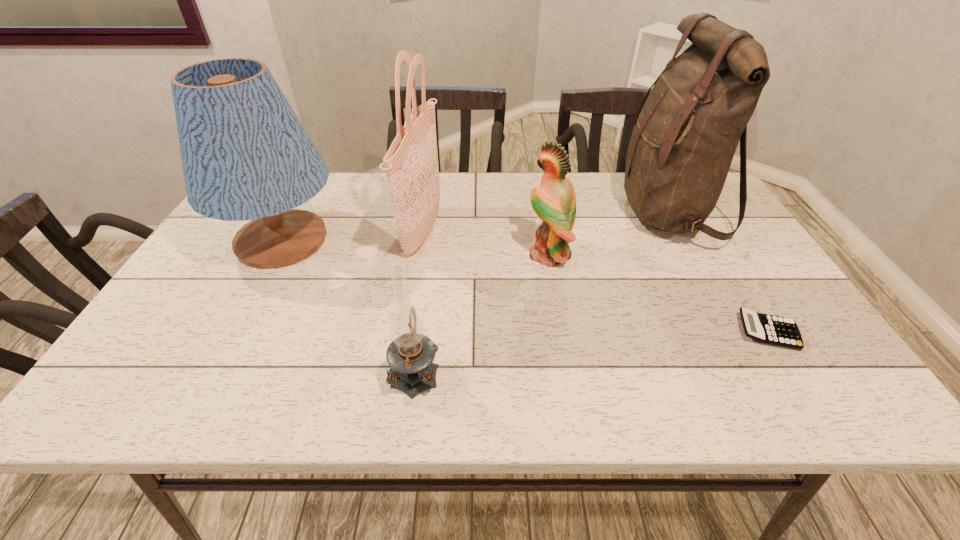
Where is `backpack`? The image size is (960, 540). backpack is located at coordinates (684, 139).

The image size is (960, 540). Identify the location of shopping bag. (411, 164).

Where is `the leftmost object`? This screenshot has height=540, width=960. the leftmost object is located at coordinates (246, 156).

Locate an element on the screen. This screenshot has height=540, width=960. parrot is located at coordinates (554, 201).

Image resolution: width=960 pixels, height=540 pixels. In order to click on oil lamp in this screenshot , I will do `click(410, 355)`.

Where is `the shortest object`? the shortest object is located at coordinates (775, 330).

Identify the location of free space located on the open flap of the backpack. (561, 211).

Locate an element on the screen. vacant point located 0.140m on the open flap of the backpack is located at coordinates (571, 211).

Where is `vacant region located on the open flap of the backpack`? This screenshot has width=960, height=540. vacant region located on the open flap of the backpack is located at coordinates (588, 211).

Find the location of a particular element. vacant space located 0.090m on the left of the shopping bag is located at coordinates (371, 232).